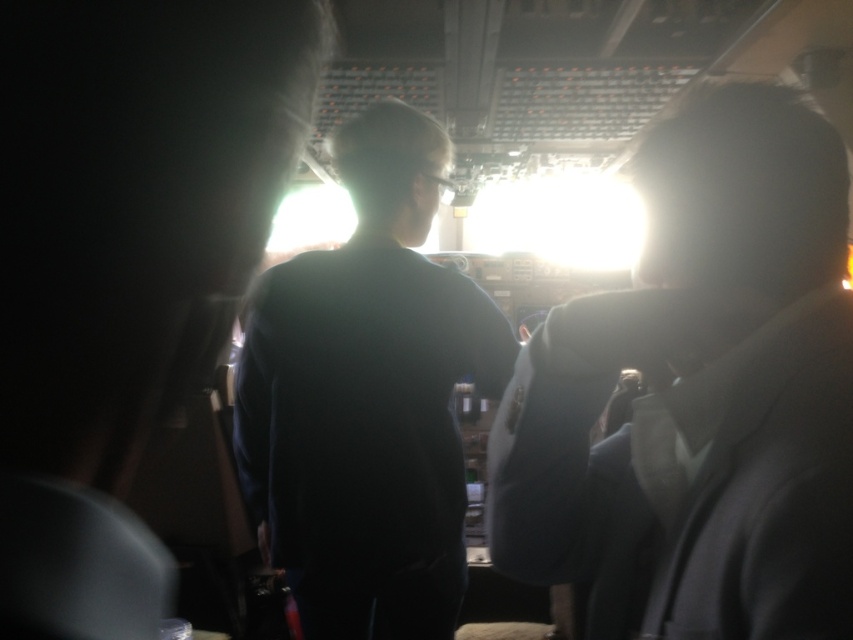
Can you confirm if dark gray suit at right is wider than matte black jacket at center?

Yes, dark gray suit at right is wider than matte black jacket at center.

Looking at this image, can you confirm if dark gray suit at right is taller than matte black jacket at center?

Correct, dark gray suit at right is much taller as matte black jacket at center.

Who is more forward, [517,408] or [47,218]?

Point [47,218] is more forward.

At what (x,y) coordinates should I click in order to perform the action: click on dark gray suit at right. Please return your answer as a coordinate pair (x, y). Looking at the image, I should click on (699, 396).

Who is positioned more to the left, matte black jacket at center or dark matte shirt at center?

From the viewer's perspective, dark matte shirt at center appears more on the left side.

Looking at this image, measure the distance between matte black jacket at center and camera.

They are 8.29 inches apart.

Where is `matte black jacket at center`? Image resolution: width=853 pixels, height=640 pixels. matte black jacket at center is located at coordinates (125, 266).

Can you confirm if dark gray suit at right is positioned to the right of dark matte shirt at center?

Correct, you'll find dark gray suit at right to the right of dark matte shirt at center.

Who is more distant from viewer, [695,410] or [306,531]?

Point [306,531]

Is point (606, 600) positioned after point (364, 435)?

No.

The image size is (853, 640). Find the location of `dark gray suit at right`. dark gray suit at right is located at coordinates (699, 396).